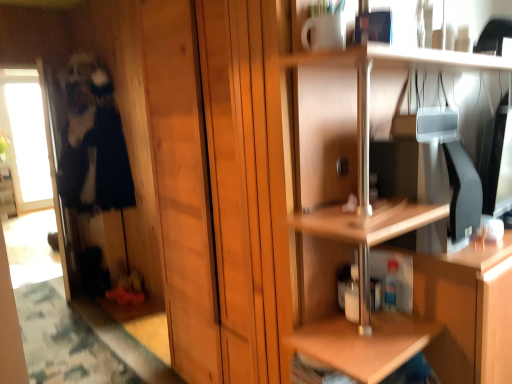
Question: Considering the relative sizes of transparent glass screen door at left and dark blue fabric at left in the image provided, is transparent glass screen door at left shorter than dark blue fabric at left?

Choices:
 (A) no
 (B) yes

Answer: (A)

Question: Can you confirm if transparent glass screen door at left is bigger than dark blue fabric at left?

Choices:
 (A) no
 (B) yes

Answer: (A)

Question: Can you confirm if transparent glass screen door at left is thinner than dark blue fabric at left?

Choices:
 (A) yes
 (B) no

Answer: (A)

Question: Is transparent glass screen door at left not inside dark blue fabric at left?

Choices:
 (A) no
 (B) yes

Answer: (A)

Question: Is transparent glass screen door at left facing towards dark blue fabric at left?

Choices:
 (A) yes
 (B) no

Answer: (A)

Question: Is transparent glass screen door at left surrounding dark blue fabric at left?

Choices:
 (A) yes
 (B) no

Answer: (B)

Question: Is dark blue fabric at left far away from transparent glass screen door at left?

Choices:
 (A) yes
 (B) no

Answer: (B)

Question: Is dark blue fabric at left facing towards transparent glass screen door at left?

Choices:
 (A) yes
 (B) no

Answer: (A)

Question: Is dark blue fabric at left looking in the opposite direction of transparent glass screen door at left?

Choices:
 (A) yes
 (B) no

Answer: (A)

Question: From a real-world perspective, is dark blue fabric at left below transparent glass screen door at left?

Choices:
 (A) no
 (B) yes

Answer: (A)

Question: Is dark blue fabric at left at the left side of transparent glass screen door at left?

Choices:
 (A) no
 (B) yes

Answer: (A)

Question: From the image's perspective, is dark blue fabric at left located above transparent glass screen door at left?

Choices:
 (A) yes
 (B) no

Answer: (A)

Question: Is wooden shelf at upper right in contact with transparent glass screen door at left?

Choices:
 (A) yes
 (B) no

Answer: (B)